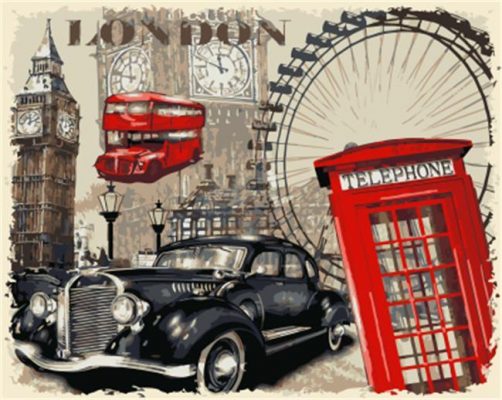
At what (x,y) coordinates should I click in order to perform the action: click on window. Please return your answer as a coordinate pair (x, y). This screenshot has height=400, width=502. Looking at the image, I should click on (199, 257).